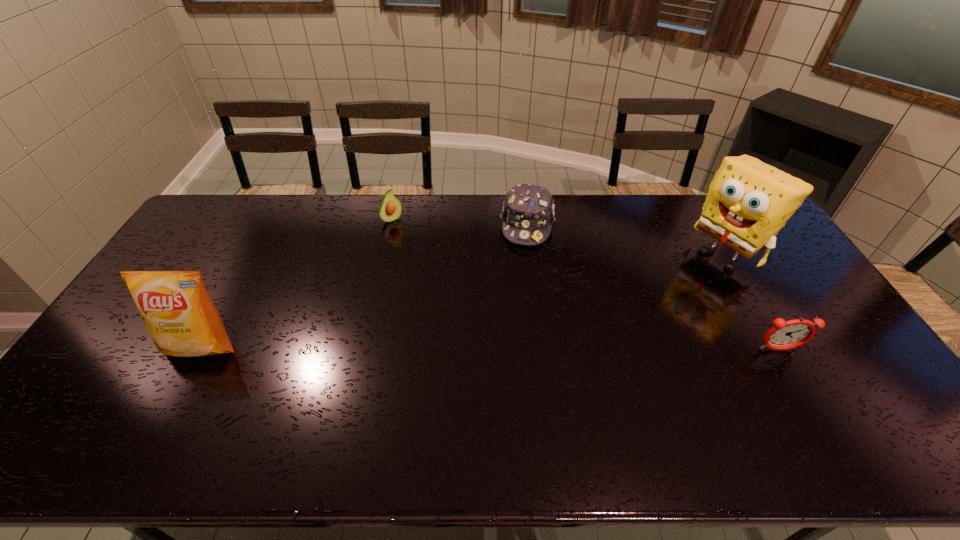
Where is `alarm clock that is at the right edge`? The width and height of the screenshot is (960, 540). alarm clock that is at the right edge is located at coordinates pyautogui.click(x=785, y=335).

Locate an element on the screen. The width and height of the screenshot is (960, 540). sponge located at the right edge is located at coordinates (748, 202).

The height and width of the screenshot is (540, 960). Find the location of `object at the far right corner`. object at the far right corner is located at coordinates (748, 202).

In the image, there is a desktop. In order to click on vacant space at the far edge in this screenshot , I will do `click(468, 214)`.

Locate an element on the screen. This screenshot has width=960, height=540. vacant space at the near edge of the desktop is located at coordinates (234, 401).

Identify the location of vacant space at the left edge. (206, 236).

Identify the location of vacant space at the far left corner. (233, 233).

Image resolution: width=960 pixels, height=540 pixels. What are the coordinates of `vacant area that lies between the sponge and the avocado` in the screenshot? It's located at (559, 237).

The width and height of the screenshot is (960, 540). Identify the location of empty space that is in between the headwear and the avocado. (x=460, y=222).

Where is `free area in between the tallest object and the fourth shortest object`? The image size is (960, 540). free area in between the tallest object and the fourth shortest object is located at coordinates (464, 301).